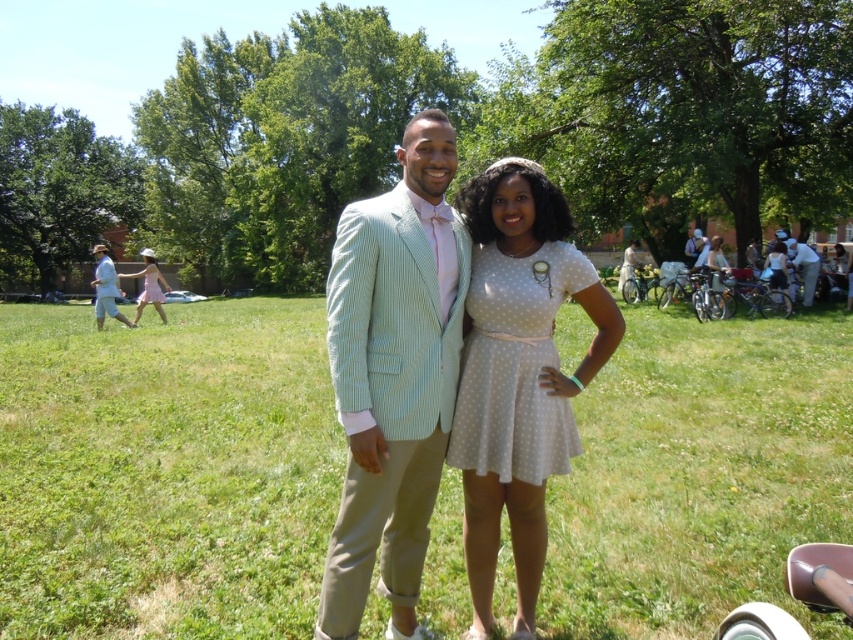
You are a photographer trying to capture a clear shot of both the white dotted dress at center and the white polka dot dress at center. Which dress is positioned further away from the camera?

The white polka dot dress at center is behind the white dotted dress at center, so it is further away from the camera.

You are standing at the point with coordinates point (715, 262) and want to walk towards the point with coordinates point (468, 556). Based on the scene, will you have an unobstructed path?

Yes, since point (468, 556) is in front of point (715, 262), there are no obstructions between them in the scene described.